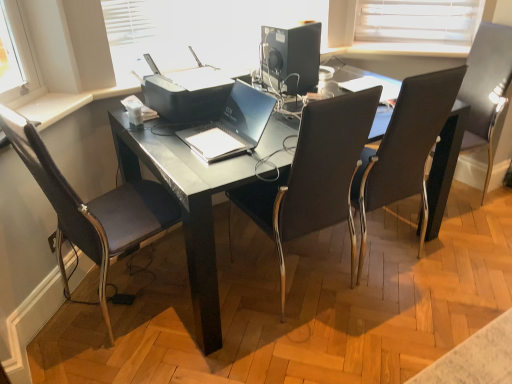
Where is `free space on the front side of black leather chair at upper right, acting as the 4th chair starting from the left`? The height and width of the screenshot is (384, 512). free space on the front side of black leather chair at upper right, acting as the 4th chair starting from the left is located at coordinates (461, 236).